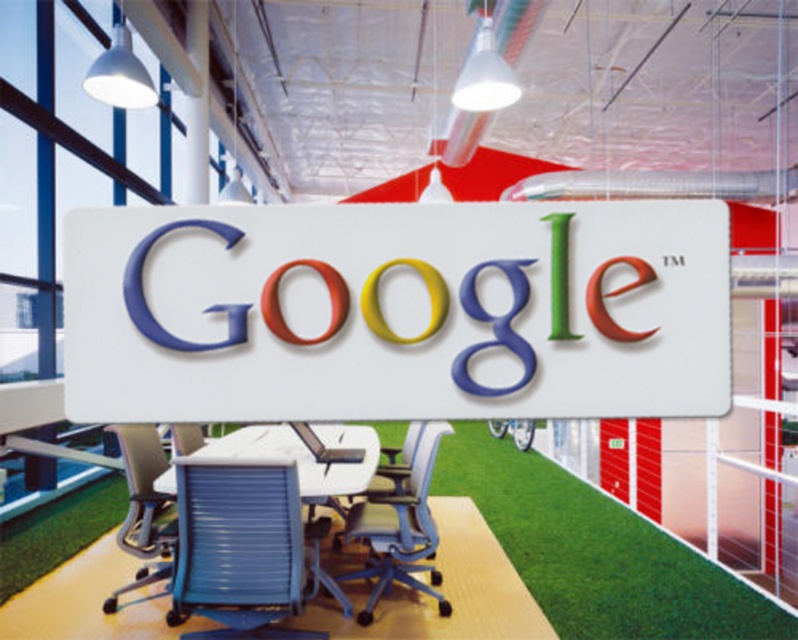
You are standing in the modern office space and want to walk from the Google logo to the conference room table. Which point, point (97, 230) or point (277, 465), is closer to you as you start walking?

Point (97, 230) is closer to the viewer than point (277, 465), so you would encounter it first as you start walking towards the conference room table.

You are an office worker who needs to choose a chair for a meeting that requires more space. Which chair between the matte blue office chair at center and the blue mesh office chair at lower left would you choose and why?

The matte blue office chair at center has a larger width than the blue mesh office chair at lower left, so it would provide more space for the meeting.

You are standing in the modern office space and want to move from point A to point B. Point A is at coordinate point (417, 548) and point B is at coordinate point (109, 600). Which point is closer to you when you first enter the office?

Point A at coordinate point (417, 548) is closer to you than point B at coordinate point (109, 600) because it is closer to the viewer.